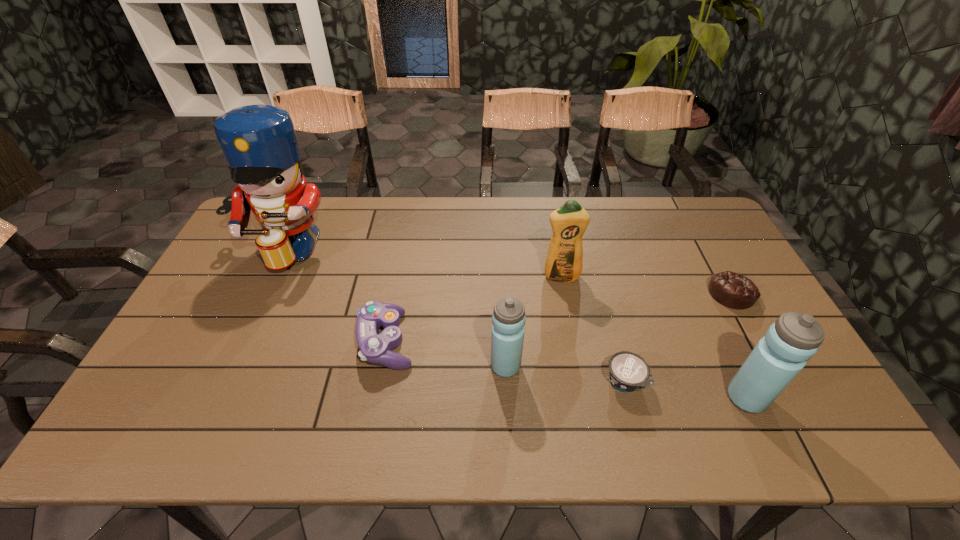
Identify the location of the left water bottle. (508, 318).

Identify the location of the farther water bottle. This screenshot has width=960, height=540. (508, 318).

You are a GUI agent. You are given a task and a screenshot of the screen. Output one action in this format:
    pyautogui.click(x=<x>, y=<y>)
    Task: Click on the right water bottle
    
    Given the screenshot: What is the action you would take?
    pyautogui.click(x=793, y=339)

Where is `the nearer water bottle`? The height and width of the screenshot is (540, 960). the nearer water bottle is located at coordinates click(793, 339).

Where is `the fourth object from left to right`? The height and width of the screenshot is (540, 960). the fourth object from left to right is located at coordinates (564, 261).

At what (x,y) coordinates should I click in order to perform the action: click on beanbag. Please return your answer as a coordinate pair (x, y). This screenshot has height=540, width=960. Looking at the image, I should click on (732, 290).

Identify the location of control. (375, 348).

This screenshot has height=540, width=960. I want to click on the second object from left to right, so click(375, 348).

Identify the location of the leftmost object. The image size is (960, 540). (259, 142).

Where is `nutcracker`? nutcracker is located at coordinates (259, 142).